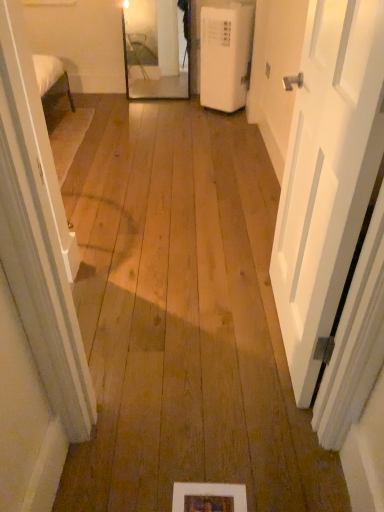
Question: Relative to wooden picture frame at lower center, is white plastic air conditioner at right in front or behind?

Choices:
 (A) front
 (B) behind

Answer: (B)

Question: From the image's perspective, is white plastic air conditioner at right located above or below wooden picture frame at lower center?

Choices:
 (A) below
 (B) above

Answer: (B)

Question: Considering the real-world distances, which object is farthest from the white plastic air conditioner at right?

Choices:
 (A) white matte door at right
 (B) wooden picture frame at lower center

Answer: (B)

Question: Which object is the closest to the white plastic air conditioner at right?

Choices:
 (A) white matte door at right
 (B) wooden picture frame at lower center

Answer: (A)